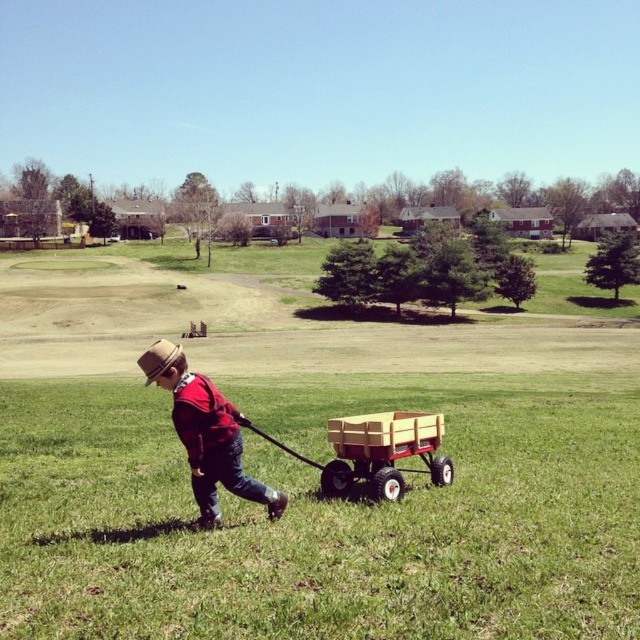
Question: Where is matte brown hat at center located in relation to wooden wagon at center in the image?

Choices:
 (A) right
 (B) left

Answer: (B)

Question: Can you confirm if matte brown hat at center is positioned to the left of wooden wagon at center?

Choices:
 (A) no
 (B) yes

Answer: (B)

Question: Considering the real-world distances, which object is closest to the matte brown hat at center?

Choices:
 (A) grassy turf golf course at center
 (B) brown straw hat at center
 (C) wooden wagon at center

Answer: (C)

Question: Which point is farther to the camera?

Choices:
 (A) matte brown hat at center
 (B) grassy turf golf course at center

Answer: (A)

Question: Which point is farther to the camera?

Choices:
 (A) brown straw hat at center
 (B) grassy turf golf course at center
 (C) wooden wagon at center
 (D) matte brown hat at center

Answer: (C)

Question: Does grassy turf golf course at center appear under brown straw hat at center?

Choices:
 (A) yes
 (B) no

Answer: (B)